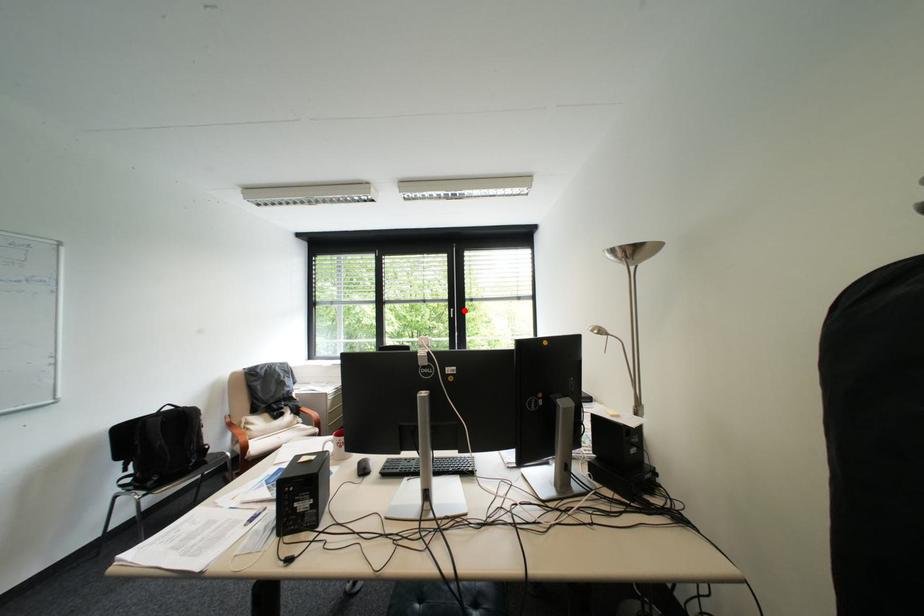
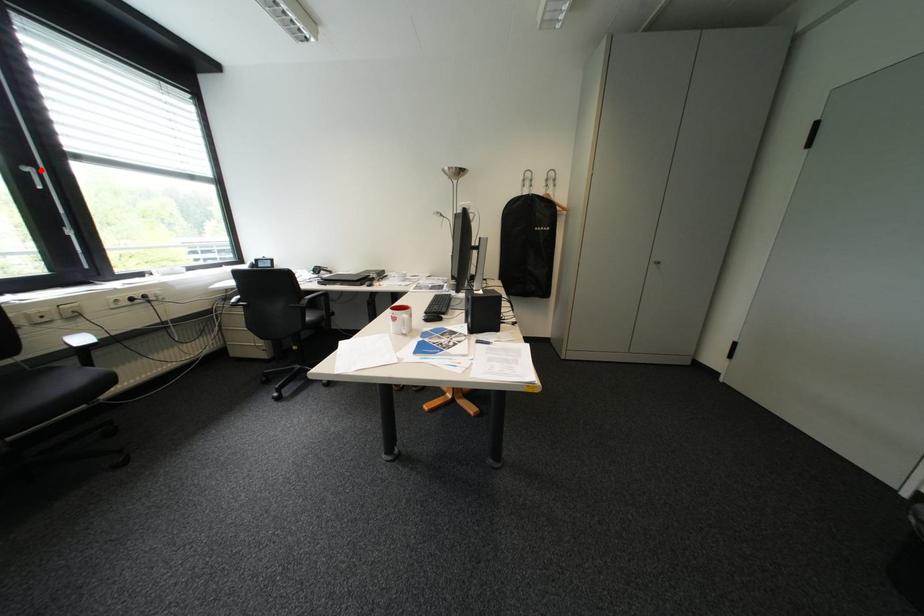
I am providing you with two images of the same scene from different viewpoints. A red point is marked on the first image and another point is marked on the second image. Is the marked point in image1 the same physical position as the marked point in image2?

Yes